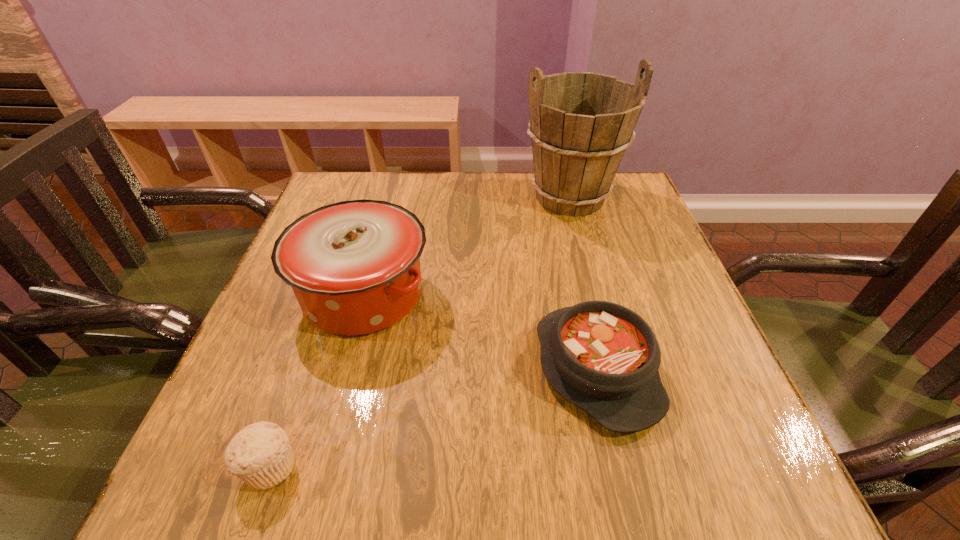
Locate an element on the screen. The image size is (960, 540). free space at the far edge is located at coordinates (540, 213).

In the image, there is a desktop. Identify the location of vacant space at the near edge. (606, 495).

Locate an element on the screen. The height and width of the screenshot is (540, 960). free space at the right edge is located at coordinates (709, 396).

Where is `free region at the far left corner`? The width and height of the screenshot is (960, 540). free region at the far left corner is located at coordinates (354, 195).

Where is `vacant area at the far right corner`? Image resolution: width=960 pixels, height=540 pixels. vacant area at the far right corner is located at coordinates click(x=633, y=217).

You are a GUI agent. You are given a task and a screenshot of the screen. Output one action in this format:
    pyautogui.click(x=<x>, y=<y>)
    Task: Click on the empty space between the shorter casserole and the muffin
    The width and height of the screenshot is (960, 540).
    Given the screenshot: What is the action you would take?
    pyautogui.click(x=433, y=417)

Where is `free space between the third shortest object and the tallest object`? The width and height of the screenshot is (960, 540). free space between the third shortest object and the tallest object is located at coordinates (467, 246).

Find the location of a particular element. The height and width of the screenshot is (540, 960). free spot between the tallest object and the taller casserole is located at coordinates (467, 246).

Identify the location of blank region between the taller casserole and the farthest object. (467, 246).

Where is `empty space that is in between the right casserole and the tallest object`? The width and height of the screenshot is (960, 540). empty space that is in between the right casserole and the tallest object is located at coordinates (583, 283).